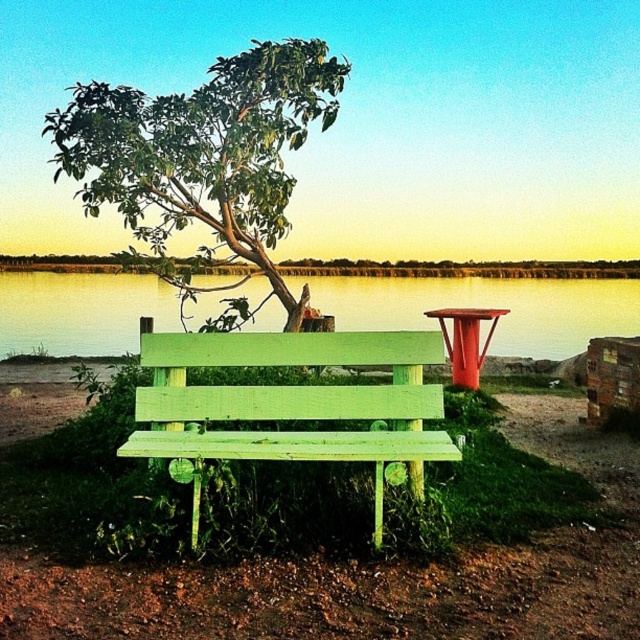
You are an artist setting up your easel to paint the lakeside scene. You want to capture the green leafy tree at upper center and the green painted wood bench at center in your painting. Which object should you focus on first if you want to paint the wider one?

The green leafy tree at upper center should be focused on first since its width surpasses that of the green painted wood bench at center.

You are standing at the lakeside and want to walk towards the point that is closer to you. Which point would you walk towards, point (259, 260) or point (465, 280)?

Point (259, 260) is in front of point (465, 280), so you should walk towards point (259, 260) as it is closer to your current position.